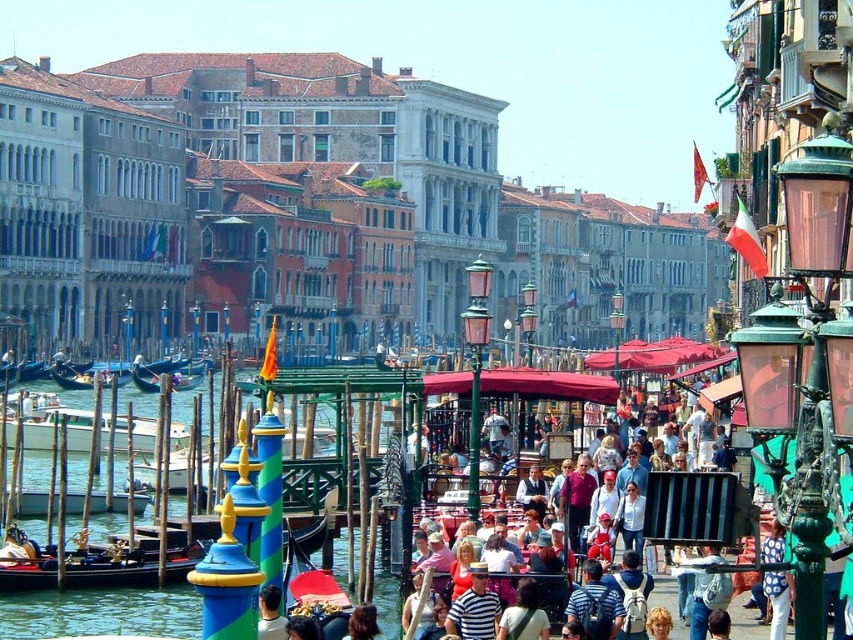
Question: Which is nearer to the smooth skin head at center?

Choices:
 (A) wooden gondola at left
 (B) black polished wood gondola at lower left
 (C) dark blue polished wood gondola at left

Answer: (B)

Question: Does black polished wood gondola at lower left come behind dark blue polished wood gondola at left?

Choices:
 (A) no
 (B) yes

Answer: (A)

Question: Which point is closer to the camera?

Choices:
 (A) (27, 436)
 (B) (73, 557)

Answer: (B)

Question: Does black polished wood gondola at lower left appear over wooden gondola at left?

Choices:
 (A) yes
 (B) no

Answer: (B)

Question: Does wooden gondola at left appear over smooth skin head at center?

Choices:
 (A) no
 (B) yes

Answer: (B)

Question: Which object is positioned closest to the wooden gondola at left?

Choices:
 (A) dark blue polished wood gondola at left
 (B) white wooden boat at center

Answer: (A)